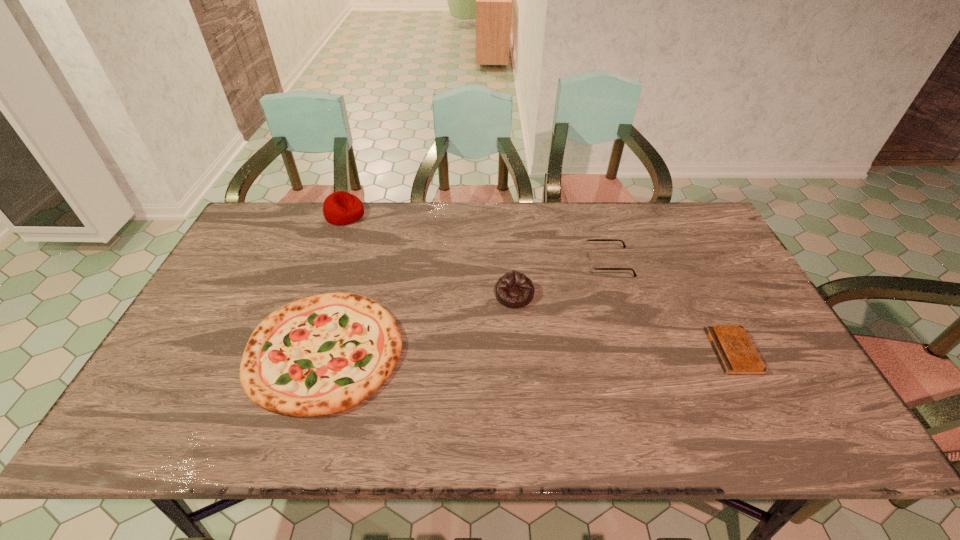
Find the location of a particular element. The image size is (960, 540). the taller beanbag is located at coordinates (340, 208).

Image resolution: width=960 pixels, height=540 pixels. Identify the location of the left beanbag. (340, 208).

Find the location of `the third object from left to right`. the third object from left to right is located at coordinates (514, 289).

You are a GUI agent. You are given a task and a screenshot of the screen. Output one action in this format:
    pyautogui.click(x=<x>, y=<y>)
    Task: Click on the right beanbag
    The width and height of the screenshot is (960, 540).
    Given the screenshot: What is the action you would take?
    pyautogui.click(x=514, y=289)

Locate an element on the screen. This screenshot has height=540, width=960. spectacles is located at coordinates (591, 266).

What are the coordinates of `the second object from right to left` in the screenshot? It's located at (591, 266).

The image size is (960, 540). Identify the location of pizza. (320, 355).

What are the coordinates of `the rightmost object` in the screenshot? It's located at (737, 355).

Find the location of `the shortest object`. the shortest object is located at coordinates (737, 355).

Find the location of a particular element. This screenshot has height=540, width=960. blank area located on the seat area of the tallest object is located at coordinates (427, 214).